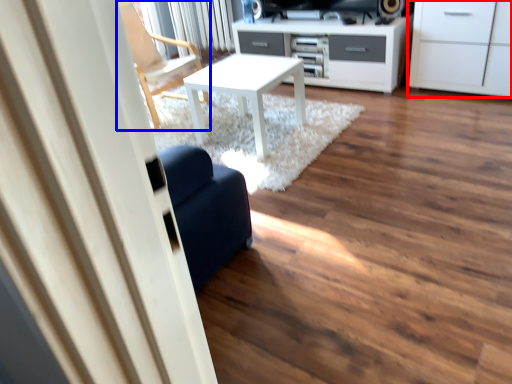
Question: Which point is further to the camera, cabinetry (highlighted by a red box) or chair (highlighted by a blue box)?

Choices:
 (A) cabinetry
 (B) chair

Answer: (B)